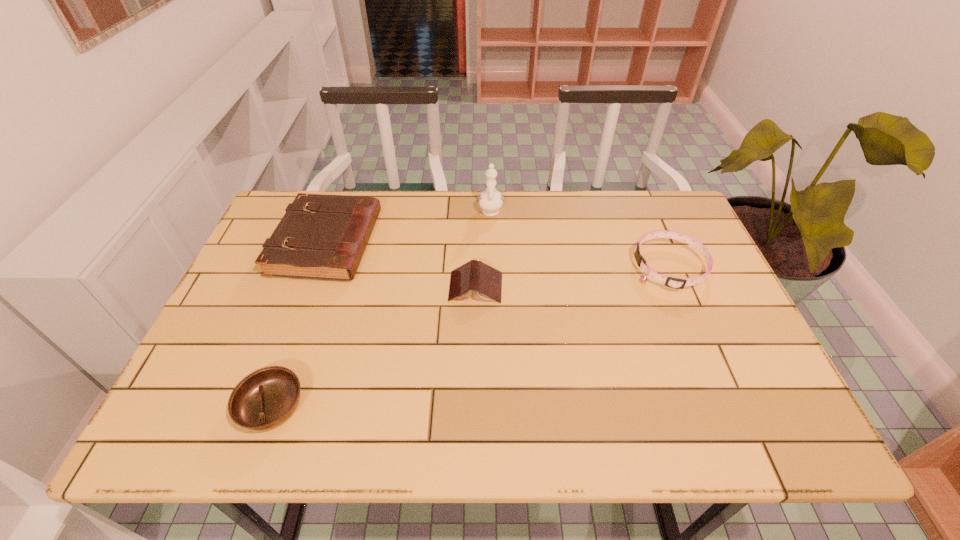
In order to click on vacant space situated 0.260m on the back of the soup bowl in this screenshot , I will do `click(314, 289)`.

Find the location of a particular element. chinaware situated at the far edge is located at coordinates (490, 201).

I want to click on hardback book that is positioned at the far edge, so click(x=324, y=237).

You are a GUI agent. You are given a task and a screenshot of the screen. Output one action in this format:
    pyautogui.click(x=<x>, y=<y>)
    Task: Click on the object that is at the near edge
    This screenshot has width=960, height=540.
    Given the screenshot: What is the action you would take?
    266,398

Find the location of a particular element. hardback book that is positioned at the left edge is located at coordinates pyautogui.click(x=324, y=237).

Find the location of a particular element. This screenshot has height=540, width=960. soup bowl situated at the left edge is located at coordinates (266, 398).

In order to click on object located at the right edge in this screenshot , I will do `click(677, 283)`.

Locate an element on the screen. The width and height of the screenshot is (960, 540). object located in the far left corner section of the desktop is located at coordinates (324, 237).

You are a GUI agent. You are given a task and a screenshot of the screen. Output one action in this format:
    pyautogui.click(x=<x>, y=<y>)
    Task: Click on the object that is at the near left corner
    The image size is (960, 540).
    Given the screenshot: What is the action you would take?
    pyautogui.click(x=266, y=398)

Where is `vacant area at the far edge of the desktop`? The height and width of the screenshot is (540, 960). vacant area at the far edge of the desktop is located at coordinates (485, 228).